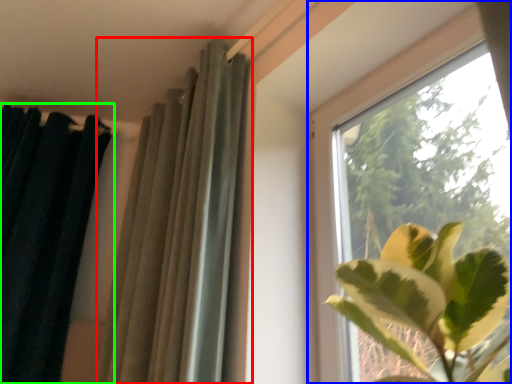
Question: Which is farther away from curtain (highlighted by a red box)? window (highlighted by a blue box) or curtain (highlighted by a green box)?

Choices:
 (A) window
 (B) curtain

Answer: (B)